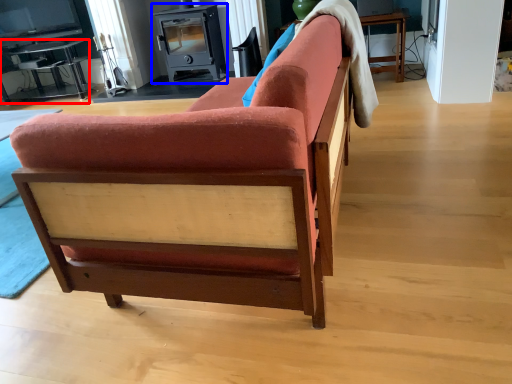
Question: Which of the following is the closest to the observer, table (highlighted by a red box) or appliance (highlighted by a blue box)?

Choices:
 (A) table
 (B) appliance

Answer: (B)